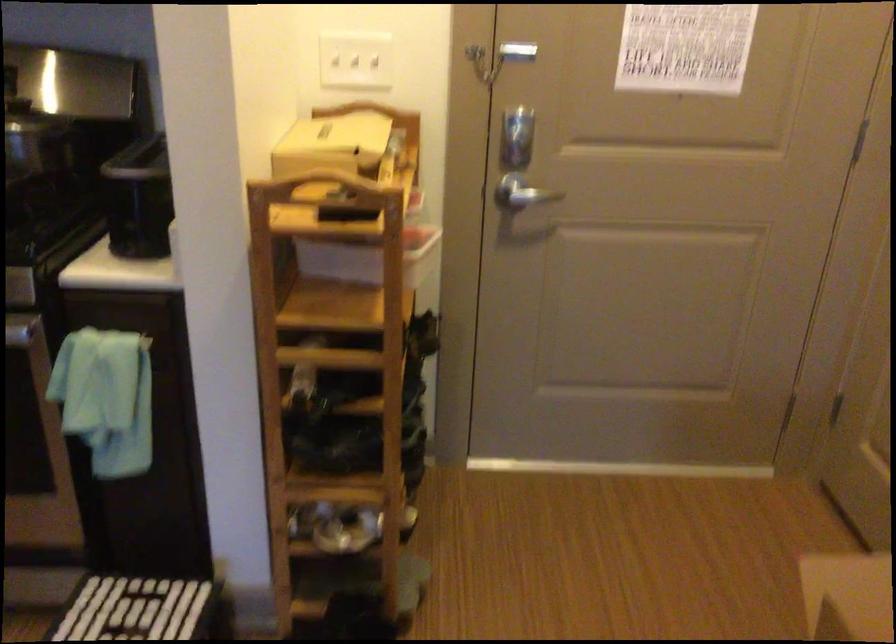
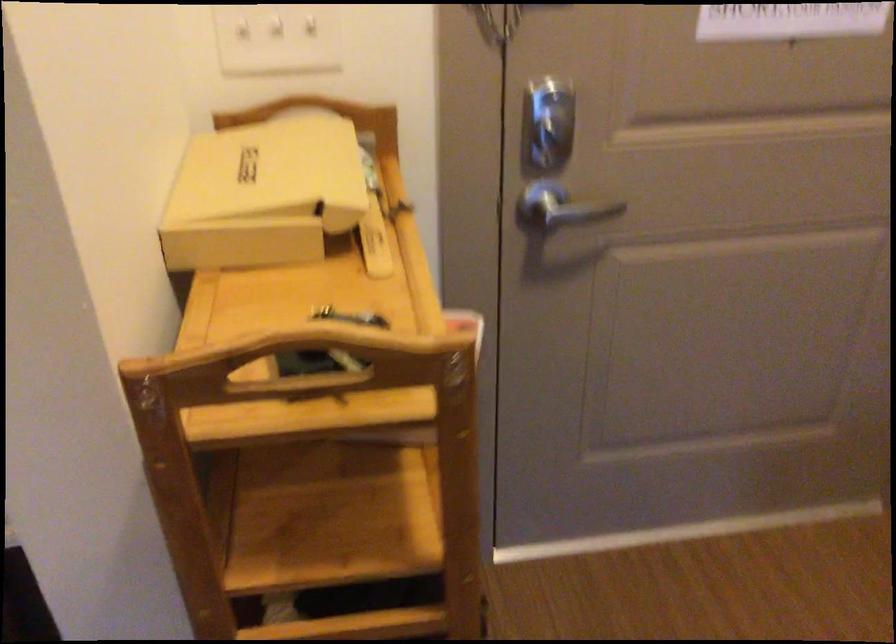
Where in the second image is the point corresponding to (362,68) from the first image?

(276, 39)